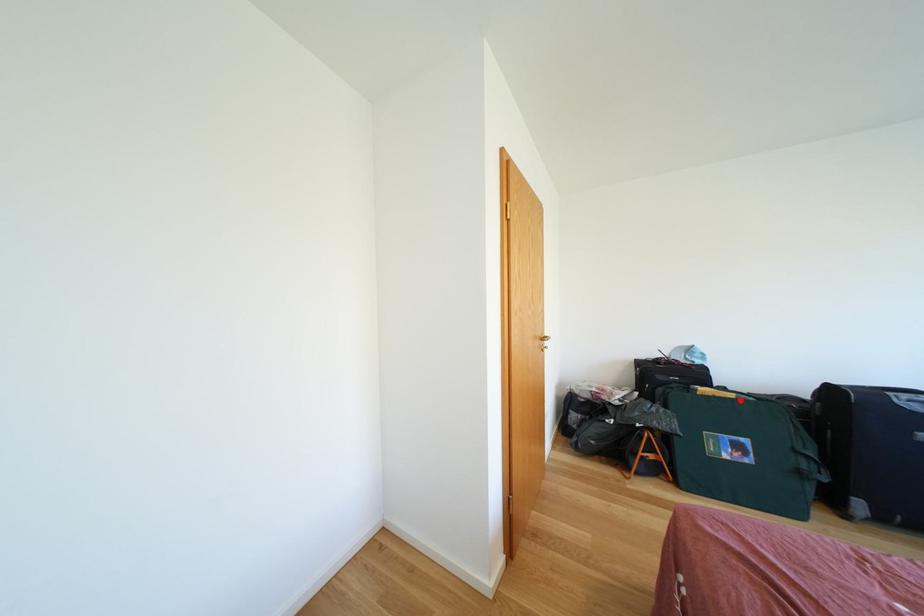
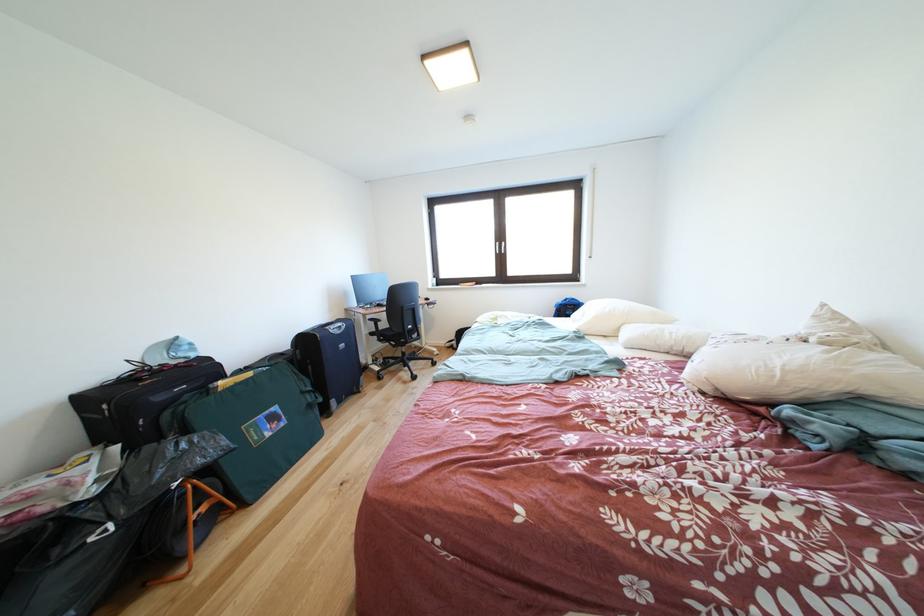
Question: I am providing you with two images of the same scene from different viewpoints. A red point is shown in image1. For the corresponding object point in image2, is it positioned nearer or farther from the camera?

Choices:
 (A) Nearer
 (B) Farther

Answer: (A)